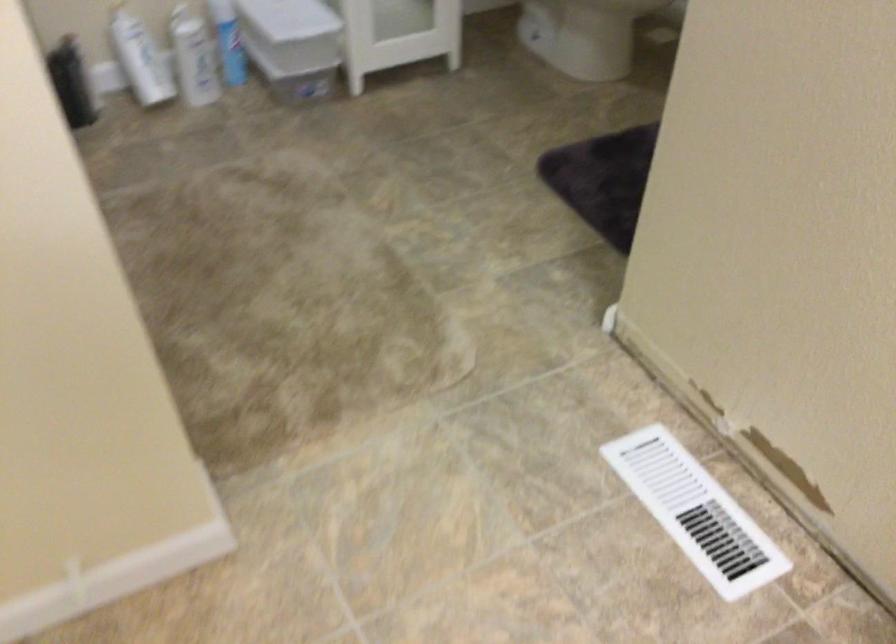
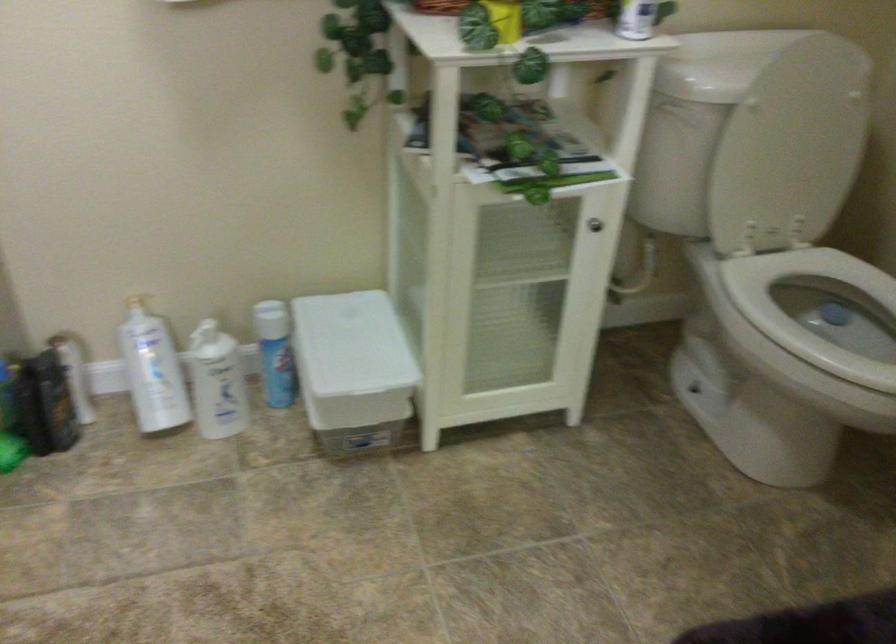
Question: Based on the continuous images, in which direction is the camera rotating? Reply with the corresponding letter.

Choices:
 (A) Left
 (B) Right
 (C) Up
 (D) Down

Answer: (A)